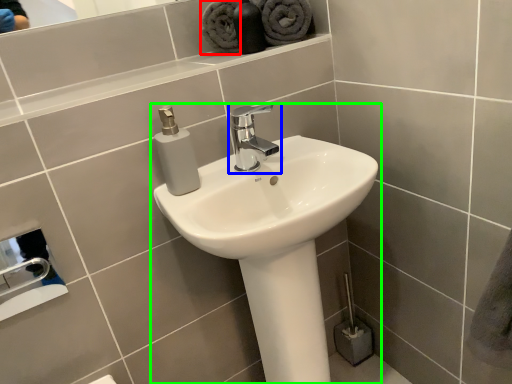
Question: Which object is the farthest from bath towel (highlighted by a red box)? Choose among these: tap (highlighted by a blue box) or sink (highlighted by a green box).

Choices:
 (A) tap
 (B) sink

Answer: (B)